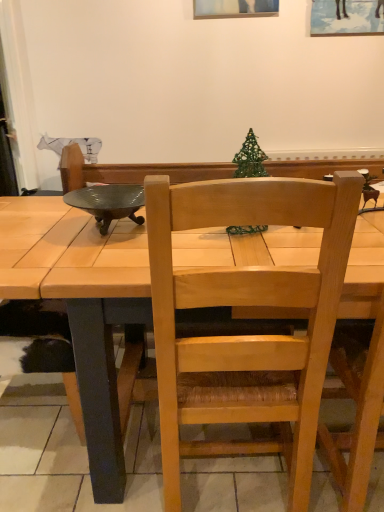
Identify the location of vacant space in metallic green bowl at upper left (from a real-world perspective). (100, 229).